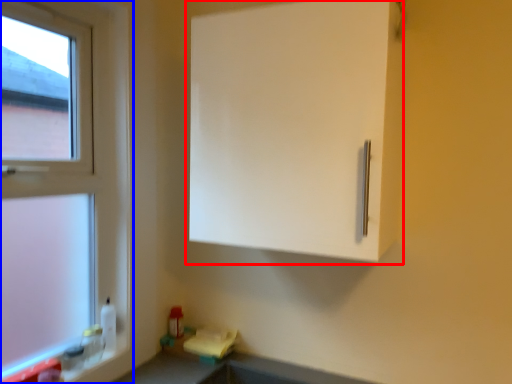
Question: Among these objects, which one is nearest to the camera, cabinetry (highlighted by a red box) or window (highlighted by a blue box)?

Choices:
 (A) cabinetry
 (B) window

Answer: (A)